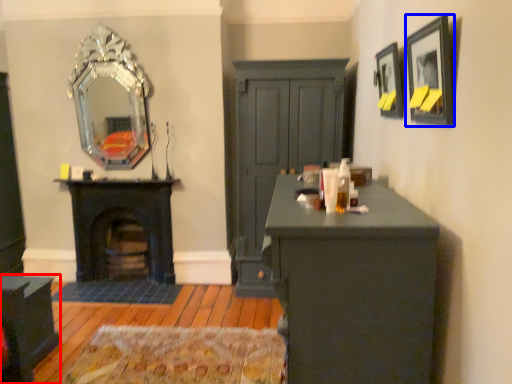
Question: Among these objects, which one is farthest to the camera, cabinetry (highlighted by a red box) or picture frame (highlighted by a blue box)?

Choices:
 (A) cabinetry
 (B) picture frame

Answer: (A)